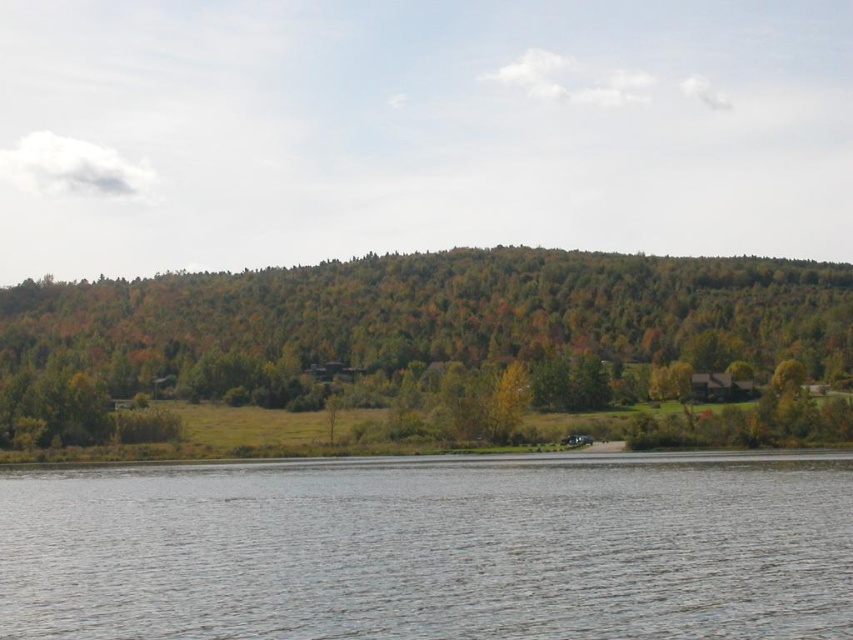
Question: Can you confirm if clear water at lower center is positioned below green leafy trees at center?

Choices:
 (A) yes
 (B) no

Answer: (A)

Question: Does clear water at lower center have a lesser width compared to green leafy trees at center?

Choices:
 (A) yes
 (B) no

Answer: (A)

Question: Which point is closer to the camera?

Choices:
 (A) green leafy trees at center
 (B) clear water at lower center

Answer: (B)

Question: Can you confirm if clear water at lower center is smaller than green leafy trees at center?

Choices:
 (A) no
 (B) yes

Answer: (B)